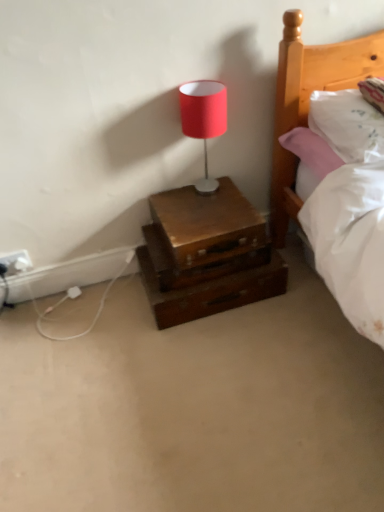
Question: Can you confirm if wooden chest at lower center is bigger than white plastic electric outlet at lower left?

Choices:
 (A) no
 (B) yes

Answer: (B)

Question: Does wooden chest at lower center have a greater height compared to white plastic electric outlet at lower left?

Choices:
 (A) yes
 (B) no

Answer: (A)

Question: Can you confirm if wooden chest at lower center is wider than white plastic electric outlet at lower left?

Choices:
 (A) yes
 (B) no

Answer: (A)

Question: From a real-world perspective, is wooden chest at lower center on top of white plastic electric outlet at lower left?

Choices:
 (A) yes
 (B) no

Answer: (A)

Question: Can you confirm if wooden chest at lower center is shorter than white plastic electric outlet at lower left?

Choices:
 (A) yes
 (B) no

Answer: (B)

Question: In terms of height, does white plastic electric outlet at lower left look taller or shorter compared to white soft mattress at lower right?

Choices:
 (A) tall
 (B) short

Answer: (B)

Question: Considering the positions of white plastic electric outlet at lower left and white soft mattress at lower right in the image, is white plastic electric outlet at lower left wider or thinner than white soft mattress at lower right?

Choices:
 (A) wide
 (B) thin

Answer: (B)

Question: From a real-world perspective, is white plastic electric outlet at lower left positioned above or below white soft mattress at lower right?

Choices:
 (A) above
 (B) below

Answer: (A)

Question: Is white plastic electric outlet at lower left bigger or smaller than white soft mattress at lower right?

Choices:
 (A) small
 (B) big

Answer: (A)

Question: Is wooden chest at lower center in front of or behind white plastic electric outlet at lower left in the image?

Choices:
 (A) front
 (B) behind

Answer: (A)

Question: Looking at their shapes, would you say wooden chest at lower center is wider or thinner than white plastic electric outlet at lower left?

Choices:
 (A) wide
 (B) thin

Answer: (A)

Question: From a real-world perspective, is wooden chest at lower center positioned above or below white plastic electric outlet at lower left?

Choices:
 (A) above
 (B) below

Answer: (A)

Question: From the image's perspective, relative to white plastic electric outlet at lower left, is wooden chest at lower center above or below?

Choices:
 (A) below
 (B) above

Answer: (B)

Question: From the image's perspective, is wooden chest at lower center positioned above or below white soft mattress at lower right?

Choices:
 (A) below
 (B) above

Answer: (B)

Question: Do you think wooden chest at lower center is within white soft mattress at lower right, or outside of it?

Choices:
 (A) outside
 (B) inside

Answer: (A)